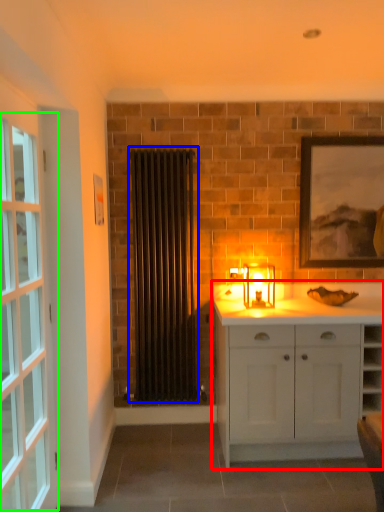
Question: Which object is positioned farthest from cabinetry (highlighted by a red box)? Select from curtain (highlighted by a blue box) and window (highlighted by a green box).

Choices:
 (A) curtain
 (B) window

Answer: (B)